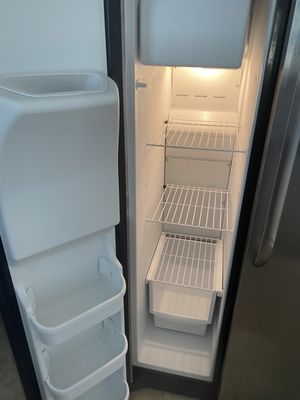
The image size is (300, 400). I want to click on fridge, so click(282, 295).